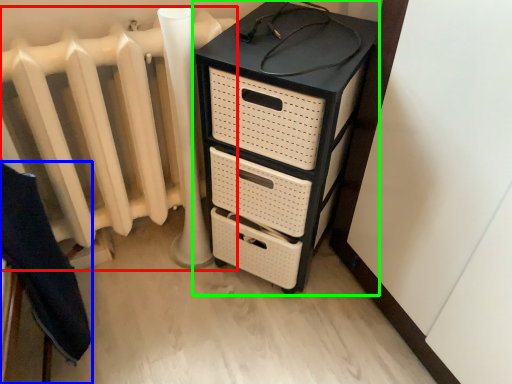
Question: Which object is the farthest from radiator (highlighted by a red box)? Choose among these: furniture (highlighted by a blue box) or chest of drawers (highlighted by a green box).

Choices:
 (A) furniture
 (B) chest of drawers

Answer: (A)